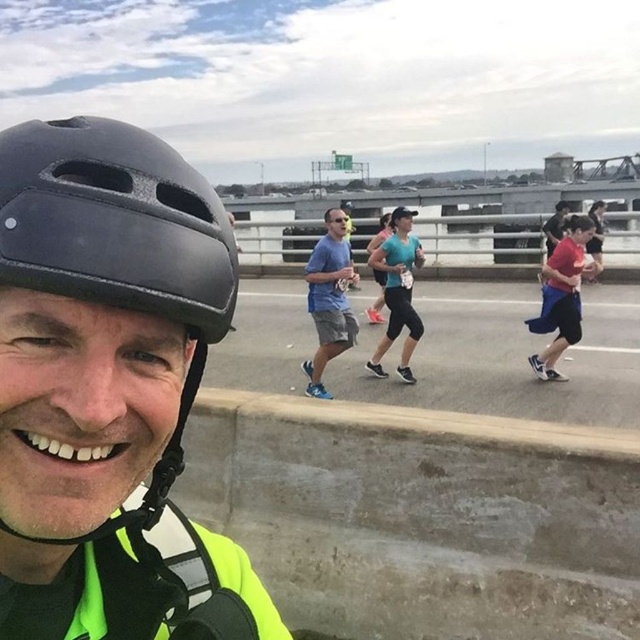
You are a photographer standing on the bridge and want to capture both the matte black helmet at center and the black matte helmet at left in a single shot. Which helmet will appear bigger in your photo?

The matte black helmet at center will appear bigger in the photo because it is larger in size than the black matte helmet at left.